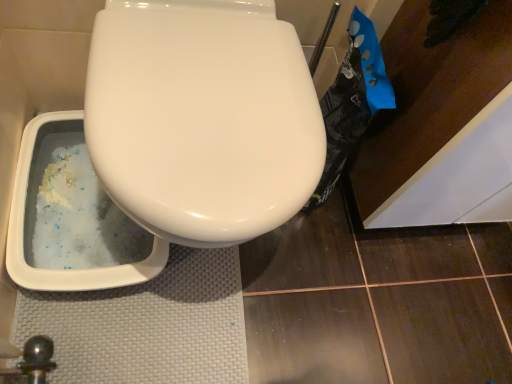
Question: Should I look upward or downward to see white glossy bidet at center?

Choices:
 (A) up
 (B) down

Answer: (A)